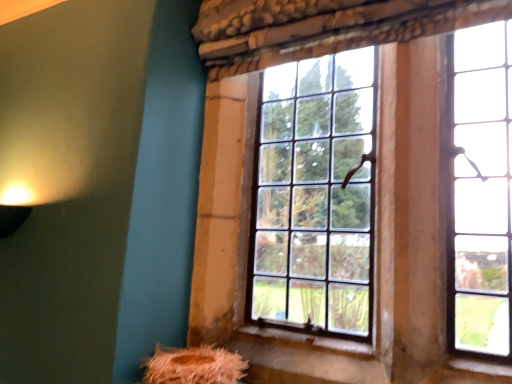
The height and width of the screenshot is (384, 512). Describe the element at coordinates (377, 179) in the screenshot. I see `clear glass window at center` at that location.

The width and height of the screenshot is (512, 384). In order to click on clear glass window at center in this screenshot , I will do `click(377, 179)`.

Measure the distance between point (378, 369) and camera.

A distance of 1.07 meters exists between point (378, 369) and camera.

I want to click on clear glass window at center, so click(x=377, y=179).